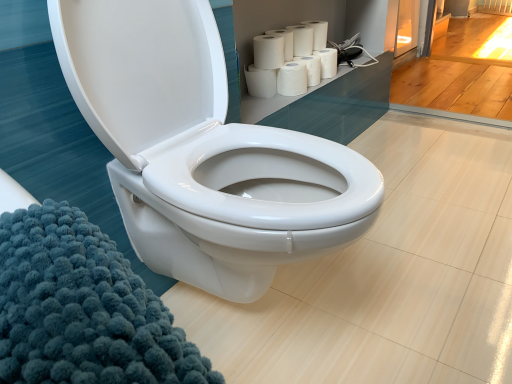
Question: In the image, is white matte toilet paper at upper center, which is the first toilet paper from top to bottom, positioned in front of or behind white matte paper towels at upper right, arranged as the fourth paper towel when ordered from the bottom?

Choices:
 (A) front
 (B) behind

Answer: (B)

Question: Considering the relative positions of white matte toilet paper at upper center, which is the 2th toilet paper from bottom to top, and white matte paper towels at upper right, the third paper towel when ordered from top to bottom, in the image provided, is white matte toilet paper at upper center, which is the 2th toilet paper from bottom to top, to the left or to the right of white matte paper towels at upper right, the third paper towel when ordered from top to bottom,?

Choices:
 (A) right
 (B) left

Answer: (A)

Question: Which object is the closest to the white matte paper towels at upper right, the third paper towel when ordered from top to bottom?

Choices:
 (A) white glossy toilet at center
 (B) white matte toilet paper at upper center, which is the 2th toilet paper from bottom to top
 (C) white matte paper towel at upper center, the 5th paper towel when ordered from bottom to top
 (D) white matte paper towel at upper right, the fourth paper towel positioned from the top
 (E) white matte toilet paper at upper right, which is the second toilet paper in top-to-bottom order

Answer: (C)

Question: Considering the real-world distances, which object is farthest from the white matte paper towel at upper right, which is the third paper towel from bottom to top?

Choices:
 (A) white matte paper towel at upper center, placed as the 1th paper towel when sorted from top to bottom
 (B) white matte toilet paper at upper right, arranged as the 1th toilet paper when ordered from the bottom
 (C) white matte paper towels at upper right, arranged as the fourth paper towel when ordered from the bottom
 (D) white matte toilet paper at upper center, which is the first toilet paper from top to bottom
 (E) white glossy toilet at center

Answer: (E)